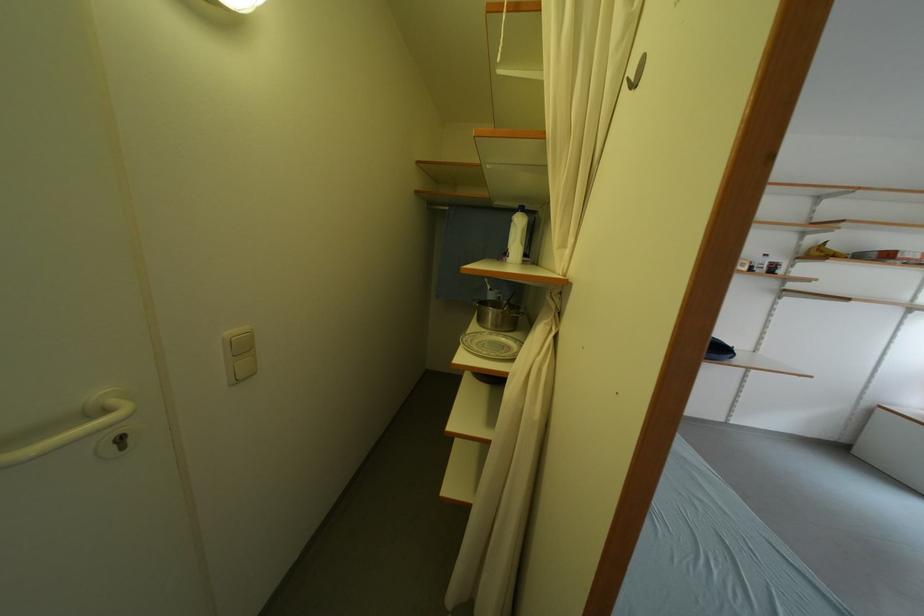
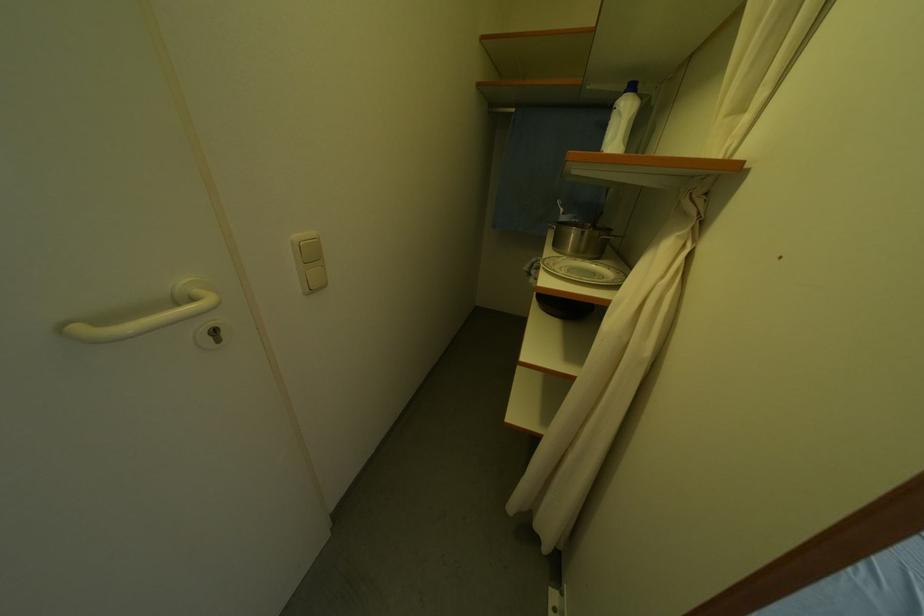
Locate, in the second image, the point that corresponds to [473,342] in the first image.

(554, 265)